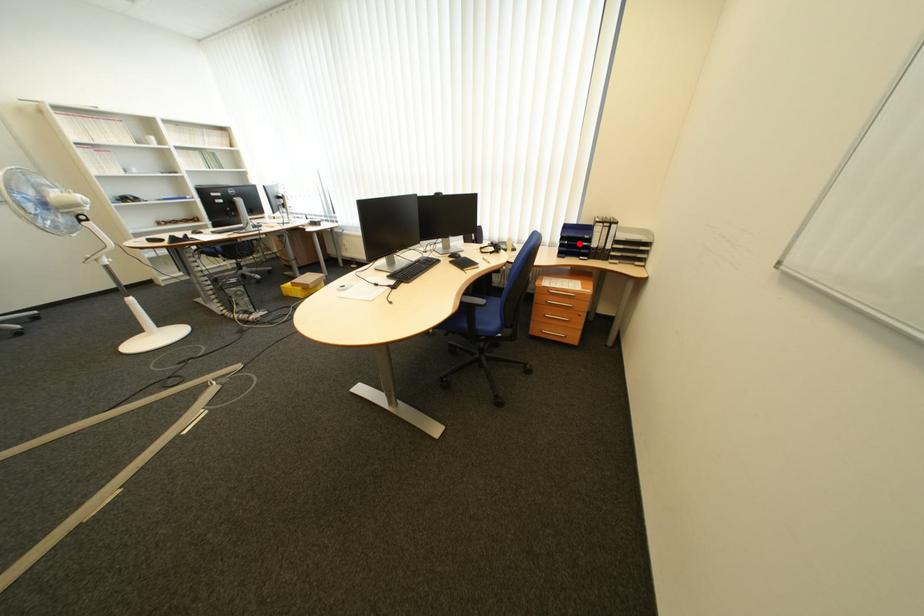
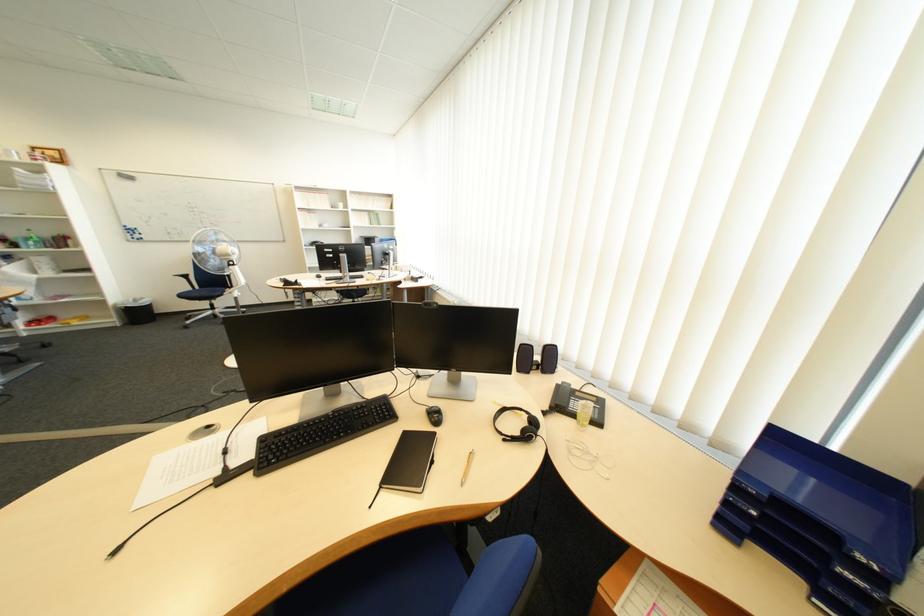
Question: A red point is marked in image1. In image2, is the corresponding 3D point closer to the camera or farther? Reply with the corresponding letter.

Choices:
 (A) The corresponding 3D point is closer.
 (B) The corresponding 3D point is farther.

Answer: (B)